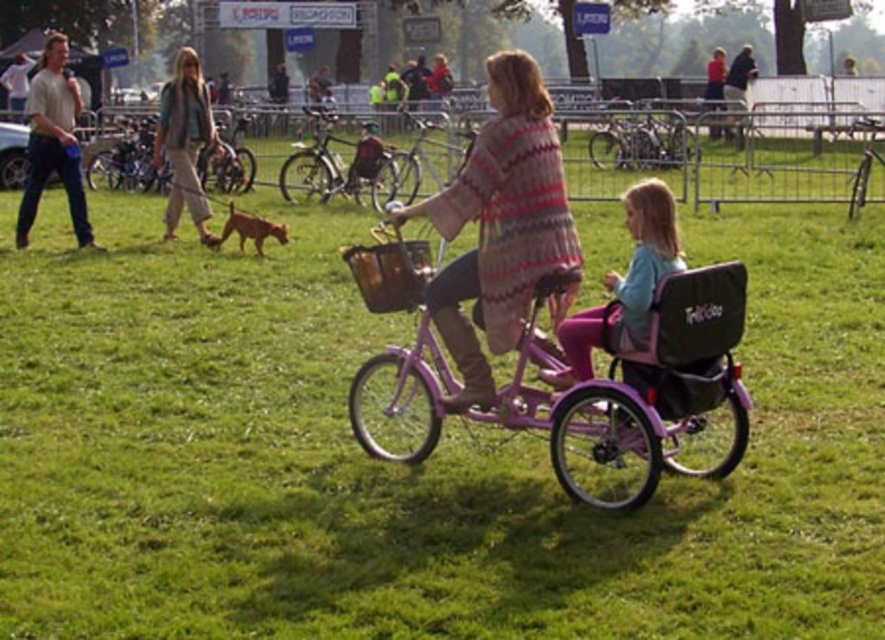
You are a cyclist who wants to choose a bicycle that is easier to carry. You see two bicycles in the image, the matte silver bicycle at center and the metallic silver bicycle at center. Which one would you choose based on their sizes?

The metallic silver bicycle at center is smaller in size, so it would be easier to carry compared to the matte silver bicycle at center.